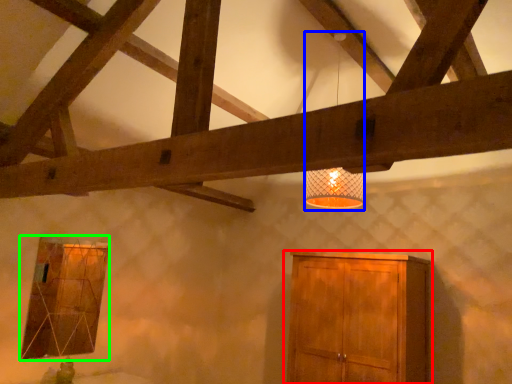
Question: Which object is positioned closest to cupboard (highlighted by a red box)? Select from lamp (highlighted by a blue box) and window (highlighted by a green box).

Choices:
 (A) lamp
 (B) window

Answer: (A)